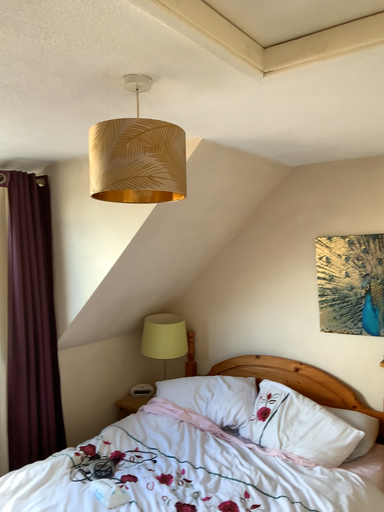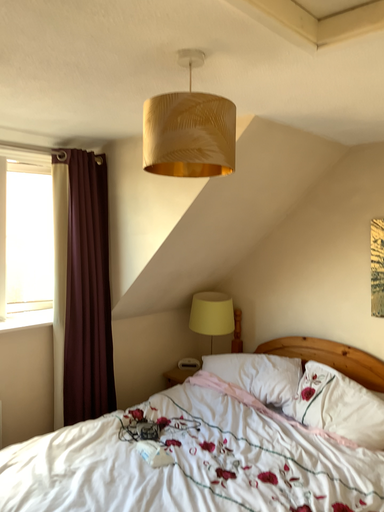
Question: Which way did the camera rotate in the video?

Choices:
 (A) rotated left
 (B) rotated right

Answer: (A)